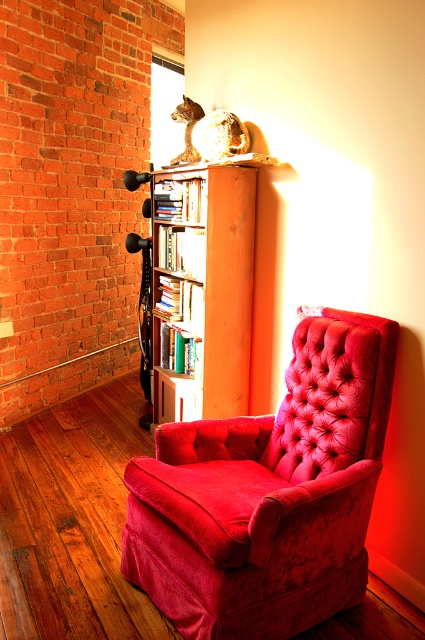
You are planning to place a tall floor lamp in this room. The lamp needs to be placed between the velvet red armchair at center and the wooden bookshelf at center. Which object should the lamp be placed closer to if you want it to be taller than both?

The lamp should be placed closer to the velvet red armchair at center because it is shorter than the wooden bookshelf at center, so positioning the lamp near the shorter object allows it to be taller than both.

You are a delivery person who needs to place a new 3.5 feet wide package between the velvet red armchair at center and the wooden bookshelf at center. Can you fit it in the space between them?

The velvet red armchair at center is 3.31 feet from the wooden bookshelf at center, so the 3.5 feet wide package cannot fit between them as the distance is slightly less than the package width.

You are planning to move a new sofa into the room. The sofa is 1.5 meters wide. You see the velvet red armchair at center and the wooden bookshelf at center. Can the sofa fit in the space between them?

The velvet red armchair at center is wider than the wooden bookshelf at center. However, the exact distance between them isn not specified in the provided information. Without knowing the distance between the two objects, it is impossible to determine if the sofa will fit.